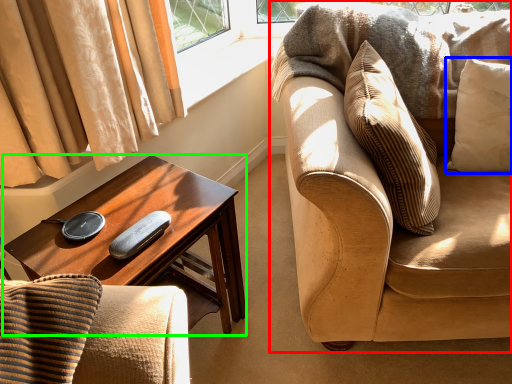
Question: Considering the real-world distances, which object is farthest from studio couch (highlighted by a red box)? pillow (highlighted by a blue box) or desk (highlighted by a green box)?

Choices:
 (A) pillow
 (B) desk

Answer: (B)